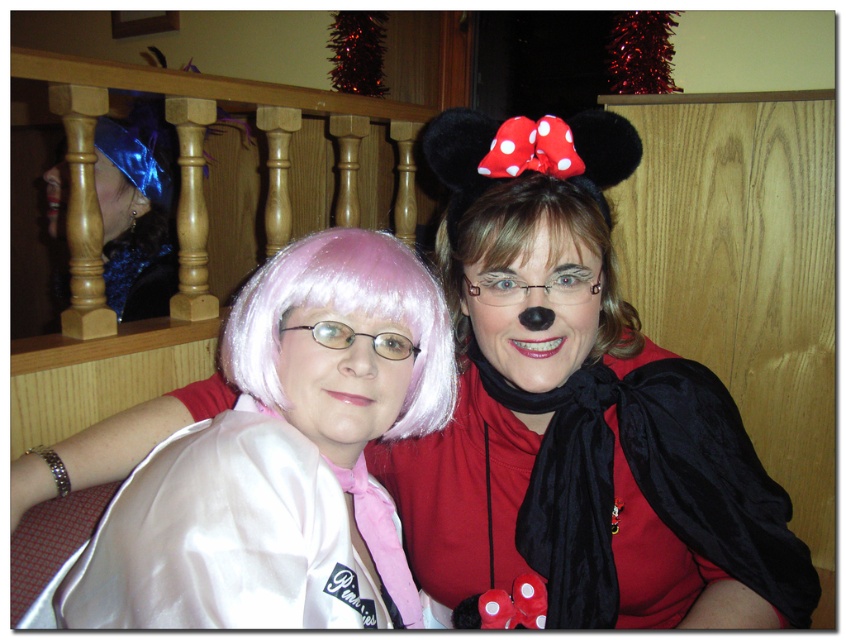
Question: Does satin white cape at center have a larger size compared to blonde hair at center?

Choices:
 (A) yes
 (B) no

Answer: (A)

Question: Which point is farther to the camera?

Choices:
 (A) pink silky wig at center
 (B) blue satin wig at upper left
 (C) satin white cape at center

Answer: (B)

Question: Which object is farther from the camera taking this photo?

Choices:
 (A) pink silky wig at center
 (B) blonde hair at center
 (C) velvet black cape at right

Answer: (C)

Question: Which object appears farthest from the camera in this image?

Choices:
 (A) pink silky wig at center
 (B) velvet black cape at right

Answer: (B)

Question: From the image, what is the correct spatial relationship of blue satin wig at upper left in relation to blonde hair at center?

Choices:
 (A) right
 (B) left

Answer: (B)

Question: Where is blue satin wig at upper left located in relation to blonde hair at center in the image?

Choices:
 (A) above
 (B) below

Answer: (A)